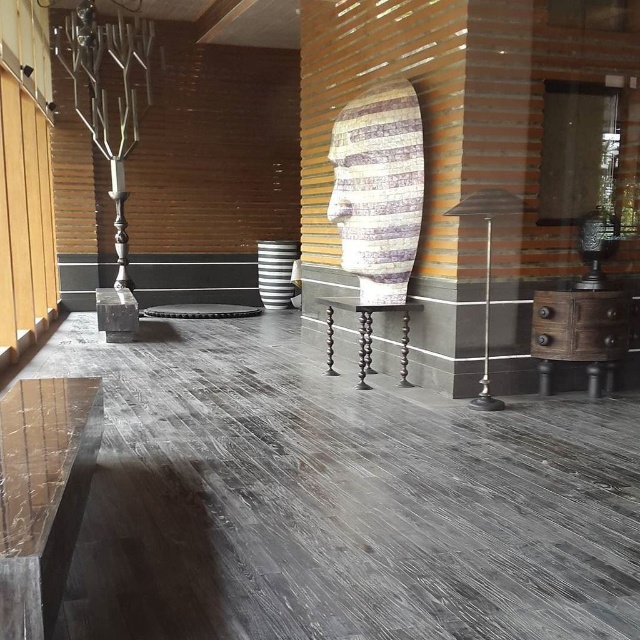
You are standing in the center of the room and want to sit down. Is the polished dark wood stool at center within your immediate reach?

The polished dark wood stool at center is located at point (365, 333), which is very close to you since you are at the center. Therefore, it is within your immediate reach.